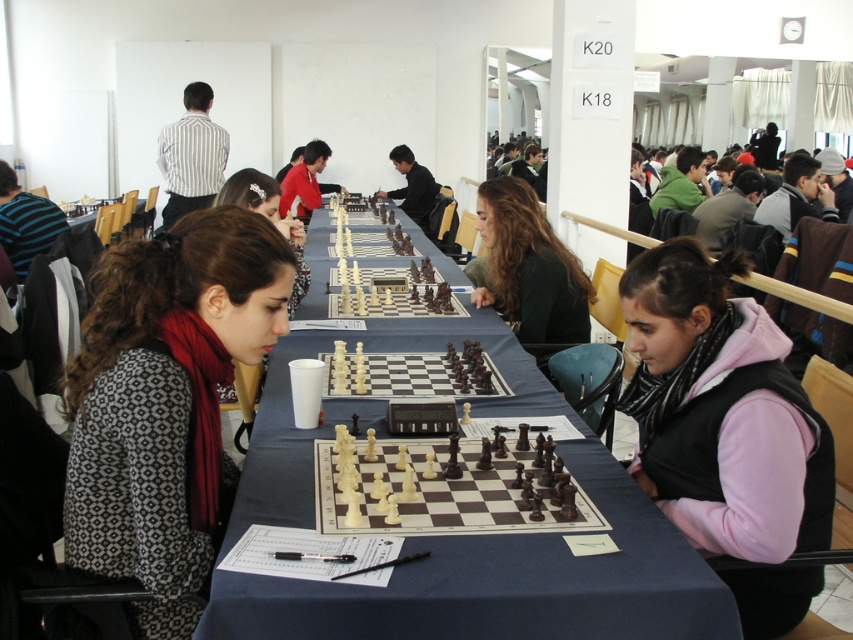
Between white striped shirt at upper center and matte black chess set at center, which one is positioned lower?

white striped shirt at upper center is lower down.

Between white striped shirt at upper center and matte black chess set at center, which one appears on the right side from the viewer's perspective?

From the viewer's perspective, matte black chess set at center appears more on the right side.

This screenshot has height=640, width=853. Identify the location of white striped shirt at upper center. (190, 156).

At what (x,y) coordinates should I click in order to perform the action: click on white striped shirt at upper center. Please return your answer as a coordinate pair (x, y). Looking at the image, I should click on (190, 156).

Is patterned fabric scarf at left to the right of white striped shirt at upper center from the viewer's perspective?

Correct, you'll find patterned fabric scarf at left to the right of white striped shirt at upper center.

Does patterned fabric scarf at left have a greater width compared to white striped shirt at upper center?

In fact, patterned fabric scarf at left might be narrower than white striped shirt at upper center.

Is point (177, 316) in front of point (218, 177)?

Yes, point (177, 316) is in front of point (218, 177).

You are a GUI agent. You are given a task and a screenshot of the screen. Output one action in this format:
    pyautogui.click(x=<x>, y=<y>)
    Task: Click on the patterned fabric scarf at left
    Image resolution: width=853 pixels, height=640 pixels.
    Given the screenshot: What is the action you would take?
    pyautogui.click(x=166, y=403)

Is point (219, 355) farther from viewer compared to point (502, 216)?

That is False.

Can you confirm if patterned fabric scarf at left is positioned to the left of green matte shirt at center?

Yes, patterned fabric scarf at left is to the left of green matte shirt at center.

Which is behind, point (260, 240) or point (489, 280)?

Point (489, 280)

The height and width of the screenshot is (640, 853). I want to click on patterned fabric scarf at left, so click(166, 403).